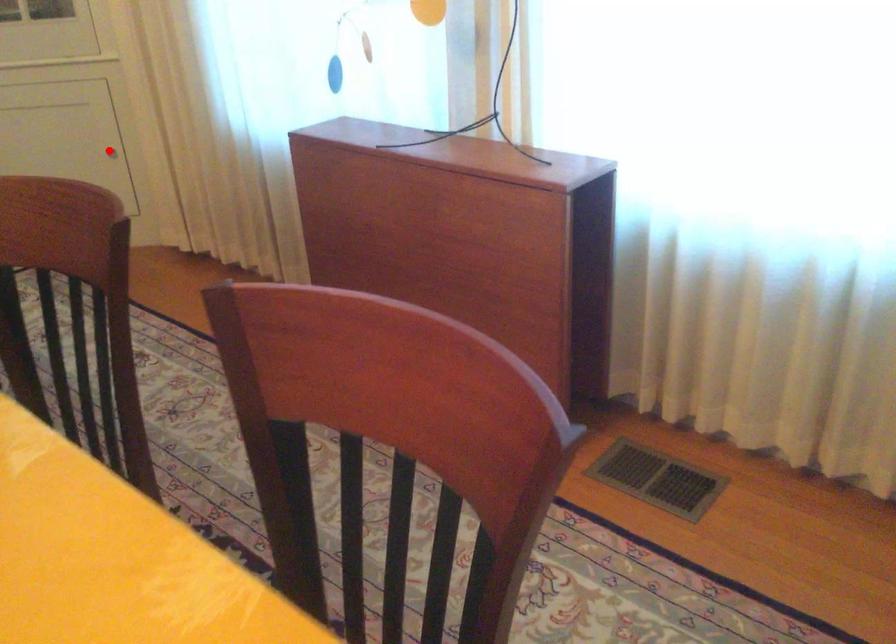
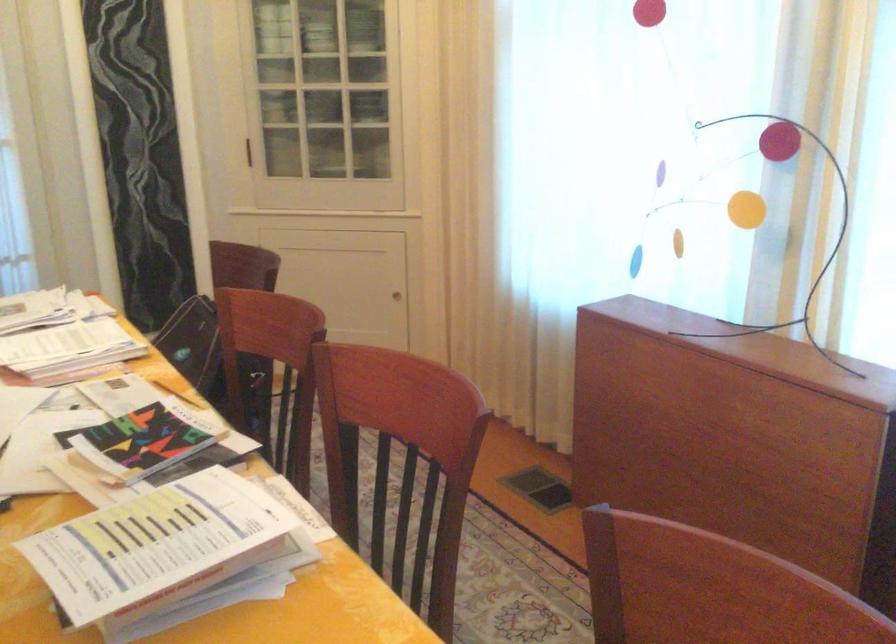
The point at the highlighted location is marked in the first image. Where is the corresponding point in the second image?

(395, 295)